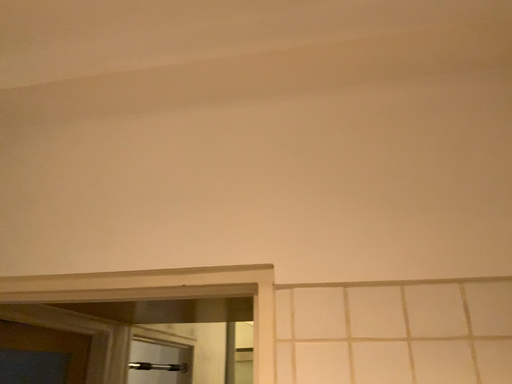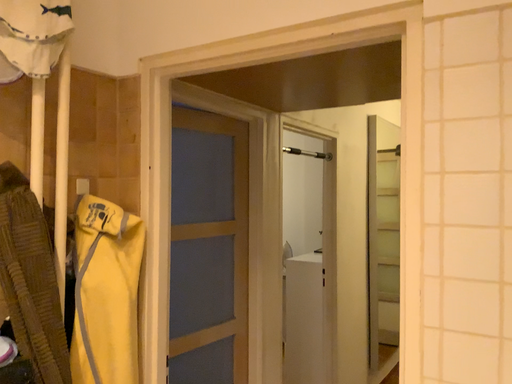
Question: Which way did the camera rotate in the video?

Choices:
 (A) rotated upward
 (B) rotated downward

Answer: (B)